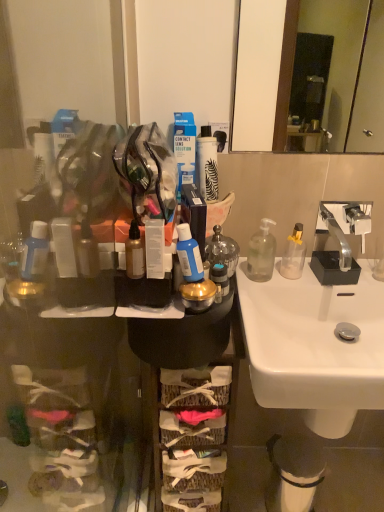
Question: Is blue matte bottle at center surrounded by transparent plastic bottle at sink, which is counted as the fourth bottle, starting from the left?

Choices:
 (A) no
 (B) yes

Answer: (A)

Question: Does transparent plastic bottle at sink, arranged as the first bottle when viewed from the right, appear on the right side of blue matte bottle at center?

Choices:
 (A) no
 (B) yes

Answer: (B)

Question: Is the position of transparent plastic bottle at sink, arranged as the first bottle when viewed from the right, less distant than that of blue matte bottle at center?

Choices:
 (A) yes
 (B) no

Answer: (B)

Question: Can you confirm if transparent plastic bottle at sink, which is counted as the fourth bottle, starting from the left, is wider than blue matte bottle at center?

Choices:
 (A) yes
 (B) no

Answer: (A)

Question: Is transparent plastic bottle at sink, which is counted as the fourth bottle, starting from the left, positioned far away from blue matte bottle at center?

Choices:
 (A) yes
 (B) no

Answer: (B)

Question: From the image's perspective, would you say transparent plastic bottle at sink, arranged as the first bottle when viewed from the right, is shown under blue matte bottle at center?

Choices:
 (A) no
 (B) yes

Answer: (A)

Question: Considering the relative positions of silver metallic faucet at upper right and blue plastic contact lens solution at center in the image provided, is silver metallic faucet at upper right in front of blue plastic contact lens solution at center?

Choices:
 (A) no
 (B) yes

Answer: (B)

Question: Could you tell me if silver metallic faucet at upper right is facing blue plastic contact lens solution at center?

Choices:
 (A) no
 (B) yes

Answer: (A)

Question: Does silver metallic faucet at upper right have a smaller size compared to blue plastic contact lens solution at center?

Choices:
 (A) yes
 (B) no

Answer: (B)

Question: Is silver metallic faucet at upper right further to camera compared to blue plastic contact lens solution at center?

Choices:
 (A) no
 (B) yes

Answer: (A)

Question: Can you confirm if silver metallic faucet at upper right is positioned to the right of blue plastic contact lens solution at center?

Choices:
 (A) no
 (B) yes

Answer: (B)

Question: From the image's perspective, is silver metallic faucet at upper right on blue plastic contact lens solution at center?

Choices:
 (A) no
 (B) yes

Answer: (A)

Question: From the image's perspective, is white matte spray can at center, the second toiletry when ordered from bottom to top, under silver metallic faucet at upper right?

Choices:
 (A) no
 (B) yes

Answer: (A)